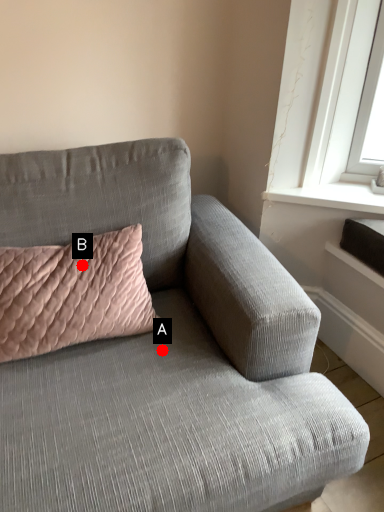
Question: Two points are circled on the image, labeled by A and B beside each circle. Which point appears farthest from the camera in this image?

Choices:
 (A) A is further
 (B) B is further

Answer: (B)